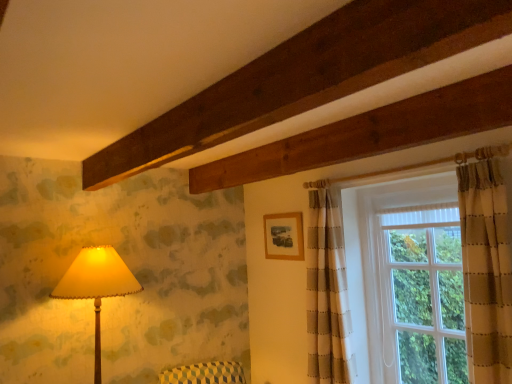
Question: From a real-world perspective, is white textured glass window at upper right, the 1th window positioned from the left, located higher than matte cream lampshade at left?

Choices:
 (A) yes
 (B) no

Answer: (A)

Question: Considering the relative sizes of white textured glass window at upper right, the 1th window positioned from the left, and matte cream lampshade at left in the image provided, is white textured glass window at upper right, the 1th window positioned from the left, shorter than matte cream lampshade at left?

Choices:
 (A) no
 (B) yes

Answer: (A)

Question: Is white textured glass window at upper right, which ranks as the second window in right-to-left order, at the right side of matte cream lampshade at left?

Choices:
 (A) no
 (B) yes

Answer: (B)

Question: Considering the relative sizes of white textured glass window at upper right, the 1th window positioned from the left, and matte cream lampshade at left in the image provided, is white textured glass window at upper right, the 1th window positioned from the left, thinner than matte cream lampshade at left?

Choices:
 (A) no
 (B) yes

Answer: (B)

Question: From a real-world perspective, is white textured glass window at upper right, which ranks as the second window in right-to-left order, physically below matte cream lampshade at left?

Choices:
 (A) no
 (B) yes

Answer: (A)

Question: Does white textured glass window at upper right, which ranks as the second window in right-to-left order, have a greater width compared to matte cream lampshade at left?

Choices:
 (A) no
 (B) yes

Answer: (A)

Question: Does clear glass window at right, the 1th window positioned from the right, have a greater width compared to wooden frame at upper center?

Choices:
 (A) yes
 (B) no

Answer: (A)

Question: Is clear glass window at right, the 1th window positioned from the right, shorter than wooden frame at upper center?

Choices:
 (A) yes
 (B) no

Answer: (B)

Question: From a real-world perspective, is clear glass window at right, the 1th window positioned from the right, on wooden frame at upper center?

Choices:
 (A) no
 (B) yes

Answer: (A)

Question: Is clear glass window at right, arranged as the 2th window when viewed from the left, directly adjacent to wooden frame at upper center?

Choices:
 (A) yes
 (B) no

Answer: (B)

Question: Is clear glass window at right, arranged as the 2th window when viewed from the left, located outside wooden frame at upper center?

Choices:
 (A) no
 (B) yes

Answer: (B)

Question: Are clear glass window at right, arranged as the 2th window when viewed from the left, and wooden frame at upper center far apart?

Choices:
 (A) no
 (B) yes

Answer: (A)

Question: Is matte cream lampshade at left to the left of white textured glass window at upper right, which ranks as the second window in right-to-left order, from the viewer's perspective?

Choices:
 (A) no
 (B) yes

Answer: (B)